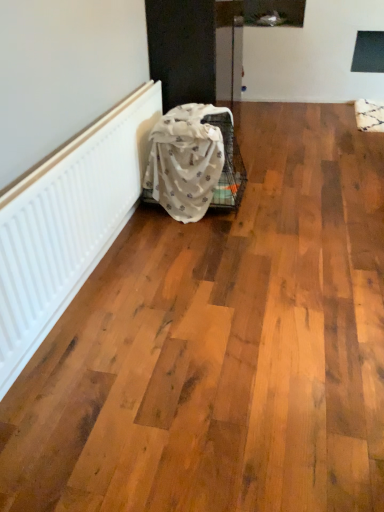
Question: Should I look upward or downward to see white textured fabric at lower left?

Choices:
 (A) up
 (B) down

Answer: (A)

Question: Is white textured radiator at left thinner than white textured fabric at lower left?

Choices:
 (A) yes
 (B) no

Answer: (A)

Question: From the image's perspective, does white textured radiator at left appear lower than white textured fabric at lower left?

Choices:
 (A) yes
 (B) no

Answer: (A)

Question: Can you confirm if white textured radiator at left is smaller than white textured fabric at lower left?

Choices:
 (A) no
 (B) yes

Answer: (B)

Question: Can you confirm if white textured radiator at left is shorter than white textured fabric at lower left?

Choices:
 (A) yes
 (B) no

Answer: (A)

Question: Is white textured radiator at left facing towards white textured fabric at lower left?

Choices:
 (A) yes
 (B) no

Answer: (A)

Question: Is white textured radiator at left outside white textured fabric at lower left?

Choices:
 (A) no
 (B) yes

Answer: (B)

Question: Can you confirm if white textured fabric at lower left is taller than white textured radiator at left?

Choices:
 (A) yes
 (B) no

Answer: (A)

Question: From a real-world perspective, is white textured fabric at lower left under white textured radiator at left?

Choices:
 (A) yes
 (B) no

Answer: (A)

Question: Is the surface of white textured fabric at lower left in direct contact with white textured radiator at left?

Choices:
 (A) no
 (B) yes

Answer: (A)

Question: From a real-world perspective, does white textured fabric at lower left stand above white textured radiator at left?

Choices:
 (A) yes
 (B) no

Answer: (B)

Question: From the image's perspective, is white textured fabric at lower left located above white textured radiator at left?

Choices:
 (A) no
 (B) yes

Answer: (B)

Question: Is white textured fabric at lower left outside white textured radiator at left?

Choices:
 (A) yes
 (B) no

Answer: (A)

Question: Based on their sizes in the image, would you say white textured fabric at lower left is bigger or smaller than white textured radiator at left?

Choices:
 (A) big
 (B) small

Answer: (A)